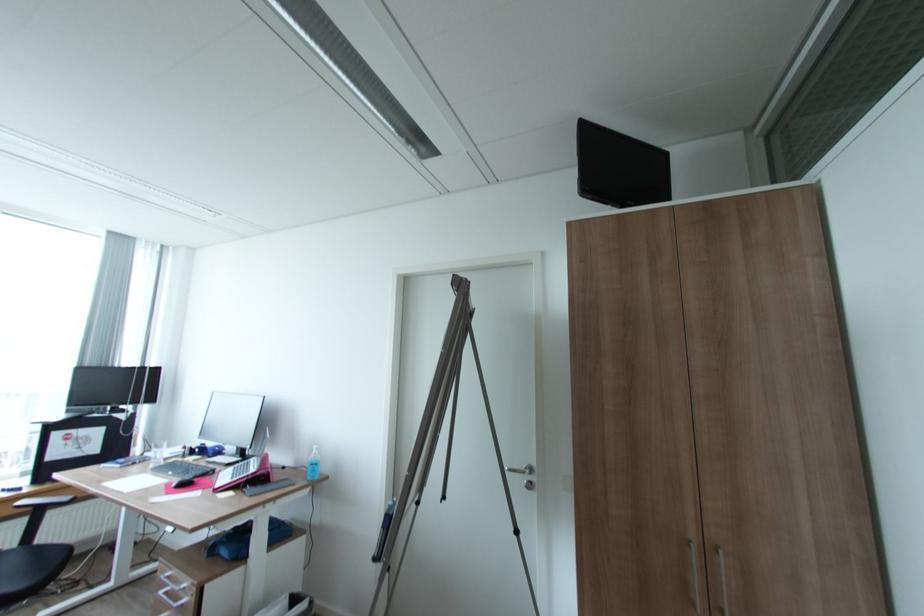
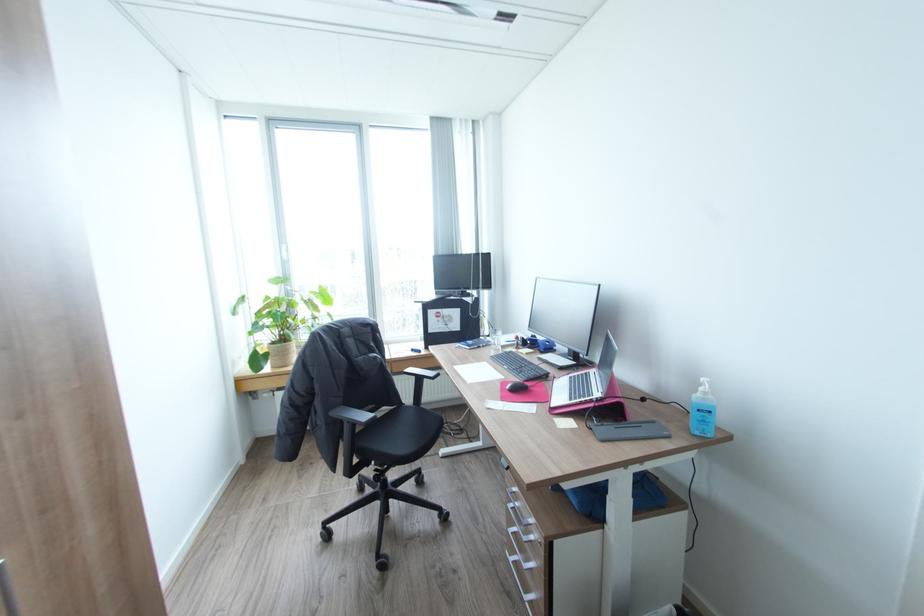
The point at (320, 454) is marked in the first image. Where is the corresponding point in the second image?

(710, 392)